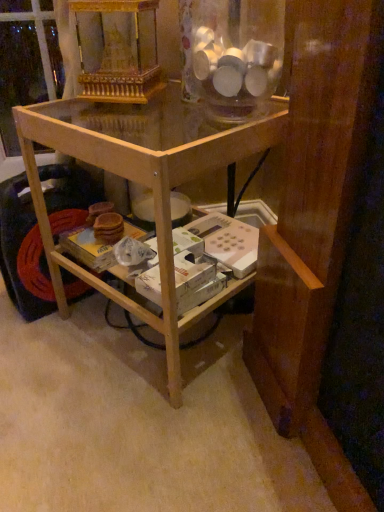
What do you see at coordinates (231, 54) in the screenshot? This screenshot has width=384, height=512. I see `transparent glass jar at upper center` at bounding box center [231, 54].

Image resolution: width=384 pixels, height=512 pixels. In order to click on transparent glass jar at upper center in this screenshot , I will do `click(231, 54)`.

You are a GUI agent. You are given a task and a screenshot of the screen. Output one action in this format:
    pyautogui.click(x=<x>, y=<y>)
    Task: Click on the light brown wood table at center
    
    Given the screenshot: What is the action you would take?
    pyautogui.click(x=140, y=182)

What do you see at coordinates (140, 182) in the screenshot? This screenshot has width=384, height=512. I see `light brown wood table at center` at bounding box center [140, 182].

Find the location of a particular element. Image resolution: width=384 pixels, height=512 pixels. transparent glass jar at upper center is located at coordinates (231, 54).

Based on their positions, is transparent glass jar at upper center located to the left or right of light brown wood table at center?

Clearly, transparent glass jar at upper center is on the right of light brown wood table at center in the image.

Relative to light brown wood table at center, is transparent glass jar at upper center in front or behind?

Clearly, transparent glass jar at upper center is behind light brown wood table at center.

Does point (252, 74) come in front of point (118, 145)?

No, it is not.

From the image's perspective, does transparent glass jar at upper center appear higher than light brown wood table at center?

Correct, transparent glass jar at upper center appears higher than light brown wood table at center in the image.

From a real-world perspective, is transparent glass jar at upper center located beneath light brown wood table at center?

No, from a real-world perspective, transparent glass jar at upper center is not under light brown wood table at center.

Does transparent glass jar at upper center have a lesser width compared to light brown wood table at center?

Indeed, transparent glass jar at upper center has a lesser width compared to light brown wood table at center.

Can you confirm if transparent glass jar at upper center is taller than light brown wood table at center?

No, transparent glass jar at upper center is not taller than light brown wood table at center.

Can you confirm if transparent glass jar at upper center is smaller than light brown wood table at center?

Indeed, transparent glass jar at upper center has a smaller size compared to light brown wood table at center.

Based on the photo, is light brown wood table at center inside transparent glass jar at upper center?

No, light brown wood table at center is located outside of transparent glass jar at upper center.

Is transparent glass jar at upper center beside light brown wood table at center?

transparent glass jar at upper center is not next to light brown wood table at center, and they're not touching.

Is transparent glass jar at upper center looking in the opposite direction of light brown wood table at center?

No.

How far apart are transparent glass jar at upper center and light brown wood table at center?

6.64 inches.

Where is `table below the transparent glass jar at upper center (from the image's perspective)`? table below the transparent glass jar at upper center (from the image's perspective) is located at coordinates (140, 182).

Considering the relative positions of light brown wood table at center and transparent glass jar at upper center in the image provided, is light brown wood table at center to the left of transparent glass jar at upper center from the viewer's perspective?

Yes.

From the picture: Does light brown wood table at center come in front of transparent glass jar at upper center?

Yes.

Does point (95, 150) lie in front of point (212, 31)?

Yes, point (95, 150) is closer to viewer.

From the image's perspective, which is below, light brown wood table at center or transparent glass jar at upper center?

From the image's view, light brown wood table at center is below.

From a real-world perspective, which is physically above, light brown wood table at center or transparent glass jar at upper center?

transparent glass jar at upper center.

Looking at their sizes, would you say light brown wood table at center is wider or thinner than transparent glass jar at upper center?

light brown wood table at center is wider than transparent glass jar at upper center.

From their relative heights in the image, would you say light brown wood table at center is taller or shorter than transparent glass jar at upper center?

In the image, light brown wood table at center appears to be taller than transparent glass jar at upper center.

Does light brown wood table at center have a smaller size compared to transparent glass jar at upper center?

No, light brown wood table at center is not smaller than transparent glass jar at upper center.

Do you think light brown wood table at center is within transparent glass jar at upper center, or outside of it?

light brown wood table at center cannot be found inside transparent glass jar at upper center.

Can you see light brown wood table at center touching transparent glass jar at upper center?

No, light brown wood table at center is not with transparent glass jar at upper center.

Is light brown wood table at center looking in the opposite direction of transparent glass jar at upper center?

No, transparent glass jar at upper center is not at the back of light brown wood table at center.

Can you tell me how much light brown wood table at center and transparent glass jar at upper center differ in facing direction?

light brown wood table at center and transparent glass jar at upper center are facing 29.6 degrees away from each other.

Where is `glass jar on the right of light brown wood table at center`? Image resolution: width=384 pixels, height=512 pixels. glass jar on the right of light brown wood table at center is located at coordinates (231, 54).

In the image, there is a light brown wood table at center. What are the coordinates of `glass jar above it (from the image's perspective)` in the screenshot? It's located at (231, 54).

Identify the location of glass jar lying behind the light brown wood table at center. Image resolution: width=384 pixels, height=512 pixels. (231, 54).